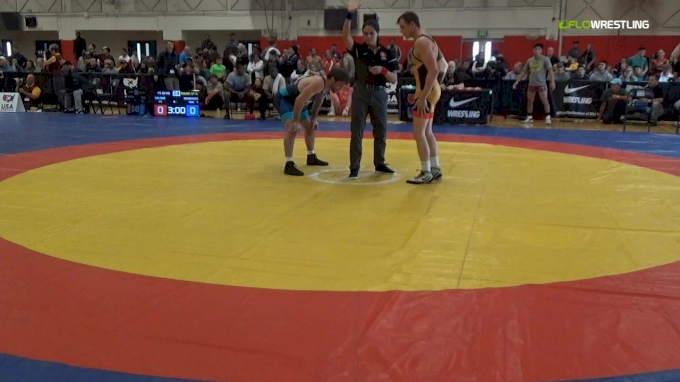
I want to click on door, so click(145, 49), click(477, 47).